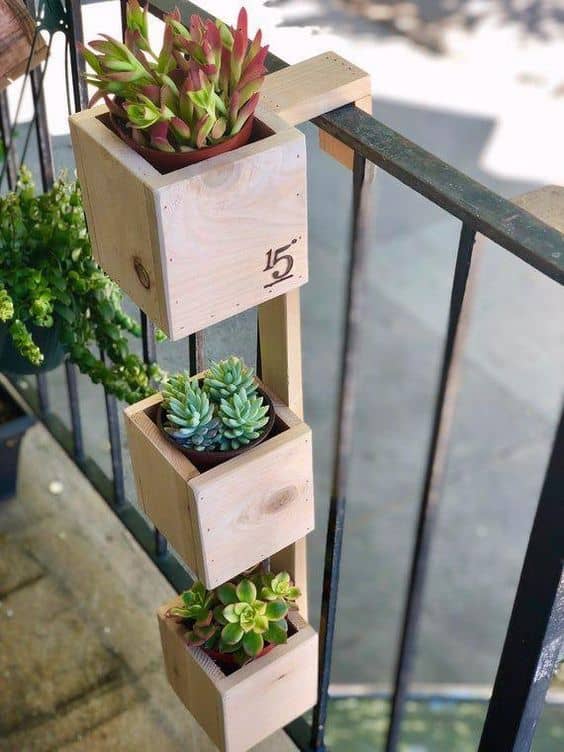
Locate an element on the screen. This screenshot has width=564, height=752. plant is located at coordinates (211, 399).